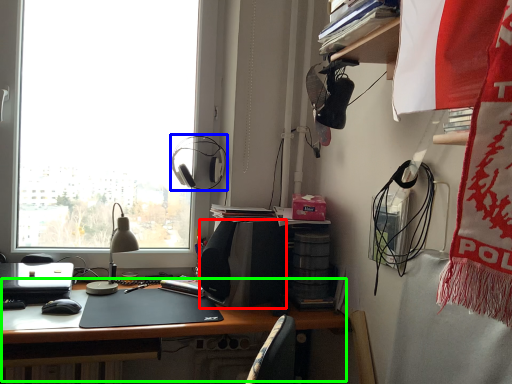
Question: Based on their relative distances, which object is farther from loudspeaker (highlighted by a red box)? Choose from earphone (highlighted by a blue box) and desk (highlighted by a green box).

Choices:
 (A) earphone
 (B) desk

Answer: (A)